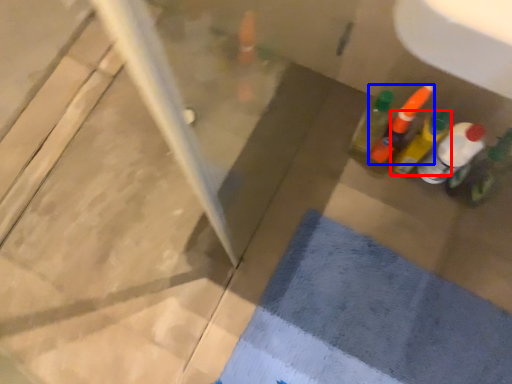
Question: Among these objects, which one is nearest to the camera, bottle (highlighted by a red box) or bottle (highlighted by a blue box)?

Choices:
 (A) bottle
 (B) bottle

Answer: (A)